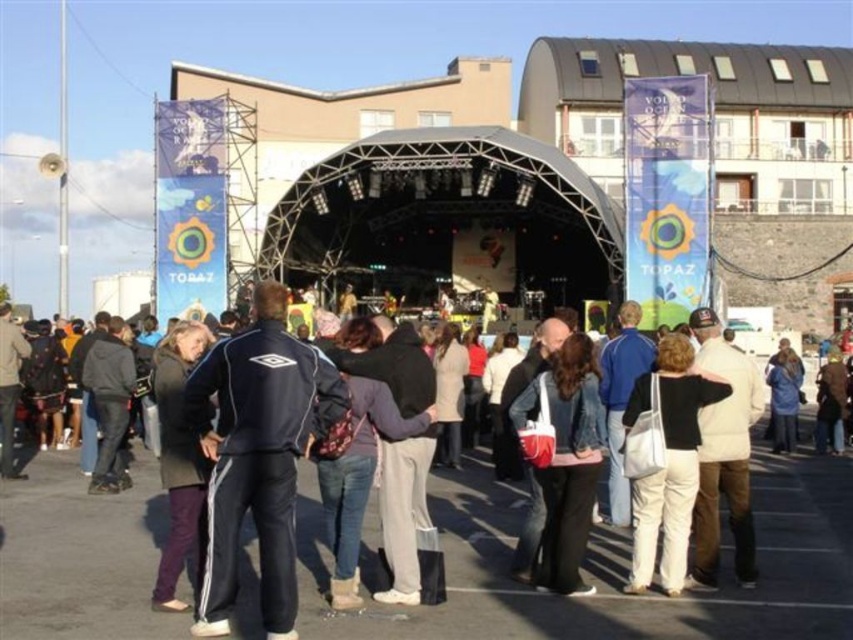
Question: Can you confirm if dark blue track pants at center is positioned below black track suit at center?

Choices:
 (A) no
 (B) yes

Answer: (B)

Question: Which object is closer to the camera taking this photo?

Choices:
 (A) white fabric bag at center
 (B) dark gray jacket at center
 (C) dark blue track pants at center
 (D) denim jacket at center

Answer: (C)

Question: Which of the following is the closest to the observer?

Choices:
 (A) (189, 509)
 (B) (561, 490)

Answer: (A)

Question: Can you confirm if white fabric bag at center is positioned below dark gray jacket at center?

Choices:
 (A) no
 (B) yes

Answer: (B)

Question: Which object is the farthest from the dark gray jacket at center?

Choices:
 (A) black track suit at center
 (B) dark blue track pants at center

Answer: (B)

Question: Is black track suit at center in front of denim jacket at center?

Choices:
 (A) no
 (B) yes

Answer: (B)